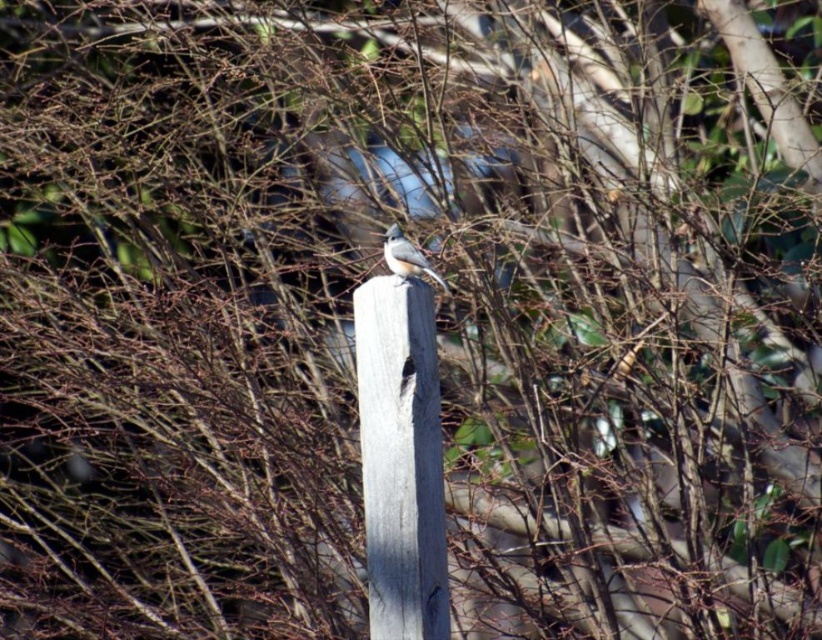
Question: Can you confirm if gray wood pole at center is smaller than grayish-brown feathers at center?

Choices:
 (A) no
 (B) yes

Answer: (A)

Question: Is gray wood pole at center below grayish-brown feathers at center?

Choices:
 (A) no
 (B) yes

Answer: (B)

Question: From the image, what is the correct spatial relationship of gray wood pole at center in relation to grayish-brown feathers at center?

Choices:
 (A) above
 (B) below

Answer: (B)

Question: Which point is farther from the camera taking this photo?

Choices:
 (A) (384, 246)
 (B) (411, 344)

Answer: (A)

Question: Which point is closer to the camera taking this photo?

Choices:
 (A) (386, 240)
 (B) (398, 632)

Answer: (B)